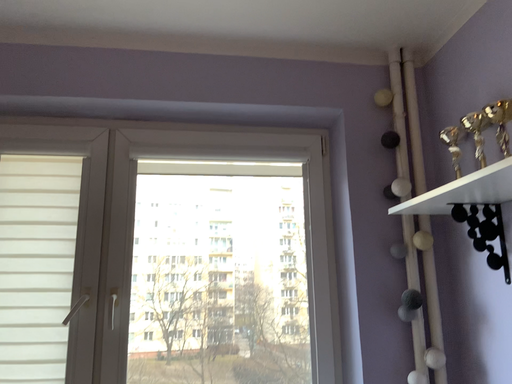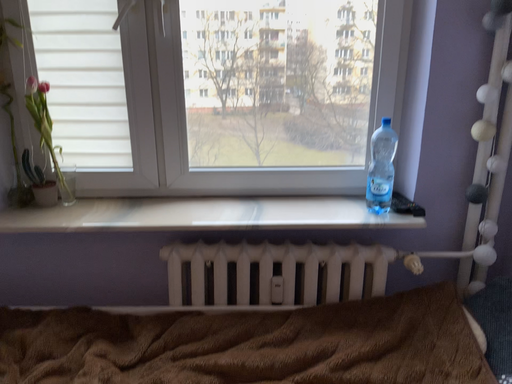
Question: Which way did the camera rotate in the video?

Choices:
 (A) rotated right
 (B) rotated left

Answer: (B)